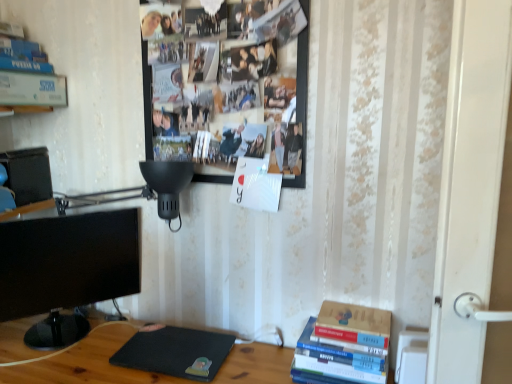
Locate an element on the screen. white matte paperback book at upper left, which is the 2th paperback book from front to back is located at coordinates (32, 89).

What is the approximate width of brown cardboard book at lower right, arranged as the first paperback book when viewed from the front?

brown cardboard book at lower right, arranged as the first paperback book when viewed from the front, is 14.06 centimeters in width.

What are the coordinates of `hardcover books at lower right` in the screenshot? It's located at (344, 345).

The height and width of the screenshot is (384, 512). I want to click on black glossy monitor at left, so click(x=66, y=270).

Locate an element on the screen. white matte paperback book at upper left, which ranks as the second paperback book in bottom-to-top order is located at coordinates 32,89.

Considering the positions of point (49, 335) and point (315, 365), is point (49, 335) closer or farther from the camera than point (315, 365)?

Clearly, point (49, 335) is more distant from the camera than point (315, 365).

Between black glossy monitor at left and hardcover books at lower right, which one has larger size?

black glossy monitor at left is bigger.

Are black glossy monitor at left and hardcover books at lower right far apart?

They are positioned close to each other.

Locate an element on the screen. television above the hardcover books at lower right (from a real-world perspective) is located at coordinates (66, 270).

Which of these two, hardcover books at lower right or brown cardboard book at lower right, acting as the 2th paperback book starting from the back, is thinner?

Thinner between the two is brown cardboard book at lower right, acting as the 2th paperback book starting from the back.

From the image's perspective, does hardcover books at lower right appear lower than brown cardboard book at lower right, which appears as the 1th paperback book when viewed from the right?

Yes.

How far apart are hardcover books at lower right and brown cardboard book at lower right, placed as the first paperback book when sorted from bottom to top?

hardcover books at lower right is 0.96 inches from brown cardboard book at lower right, placed as the first paperback book when sorted from bottom to top.

Which of these two, hardcover books at lower right or brown cardboard book at lower right, placed as the first paperback book when sorted from bottom to top, is bigger?

With larger size is hardcover books at lower right.

Based on the photo, does hardcover books at lower right have a greater height compared to black glossy monitor at left?

In fact, hardcover books at lower right may be shorter than black glossy monitor at left.

Is hardcover books at lower right positioned far away from black glossy monitor at left?

No, hardcover books at lower right is in close proximity to black glossy monitor at left.

Can you confirm if hardcover books at lower right is positioned to the left of black glossy monitor at left?

No, hardcover books at lower right is not to the left of black glossy monitor at left.

Which is closer, (338, 370) or (58, 252)?

Point (338, 370) is closer to the camera than point (58, 252).

Based on the photo, does wooden photo frame at upper center come behind brown cardboard book at lower right, which ranks as the second paperback book in left-to-right order?

No.

Between wooden photo frame at upper center and brown cardboard book at lower right, placed as the first paperback book when sorted from bottom to top, which one has more height?

wooden photo frame at upper center is taller.

From the image's perspective, is wooden photo frame at upper center above brown cardboard book at lower right, acting as the 2th paperback book starting from the back?

Indeed, from the image's perspective, wooden photo frame at upper center is shown above brown cardboard book at lower right, acting as the 2th paperback book starting from the back.

Which of these two, wooden photo frame at upper center or black matte laptop at lower center, stands shorter?

black matte laptop at lower center.

Are wooden photo frame at upper center and black matte laptop at lower center far apart?

They are positioned close to each other.

Is brown cardboard book at lower right, arranged as the first paperback book when viewed from the front, positioned in front of wooden photo frame at upper center?

No, brown cardboard book at lower right, arranged as the first paperback book when viewed from the front, is further to the viewer.

Which is in front, point (338, 316) or point (305, 52)?

Point (305, 52)

Considering the relative positions of brown cardboard book at lower right, the 2th paperback book positioned from the top, and wooden photo frame at upper center in the image provided, is brown cardboard book at lower right, the 2th paperback book positioned from the top, to the right of wooden photo frame at upper center from the viewer's perspective?

Indeed, brown cardboard book at lower right, the 2th paperback book positioned from the top, is positioned on the right side of wooden photo frame at upper center.

Based on the photo, which of these two, brown cardboard book at lower right, the 2th paperback book positioned from the top, or wooden photo frame at upper center, is bigger?

With larger size is wooden photo frame at upper center.

Between hardcover books at lower right and black matte laptop at lower center, which one has more height?

hardcover books at lower right is taller.

In terms of width, does hardcover books at lower right look wider or thinner when compared to black matte laptop at lower center?

In the image, hardcover books at lower right appears to be more narrow than black matte laptop at lower center.

From a real-world perspective, which object stands above the other?

hardcover books at lower right is physically above.

Consider the image. From the image's perspective, would you say hardcover books at lower right is positioned over black matte laptop at lower center?

Yes.

There is a hardcover books at lower right. Where is `television above it (from a real-world perspective)`? television above it (from a real-world perspective) is located at coordinates (66, 270).

Where is `book that is under the brown cardboard book at lower right, which appears as the 1th paperback book when viewed from the right (from a real-world perspective)`? The height and width of the screenshot is (384, 512). book that is under the brown cardboard book at lower right, which appears as the 1th paperback book when viewed from the right (from a real-world perspective) is located at coordinates (344, 345).

Considering their positions, is black matte laptop at lower center positioned further to hardcover books at lower right than brown cardboard book at lower right, acting as the 2th paperback book starting from the back?

black matte laptop at lower center.

Estimate the real-world distances between objects in this image. Which object is closer to hardcover books at lower right, white matte paperback book at upper left, which ranks as the second paperback book in bottom-to-top order, or black glossy monitor at left?

black glossy monitor at left.

Considering their positions, is black matte laptop at lower center positioned further to wooden photo frame at upper center than brown cardboard book at lower right, which ranks as the second paperback book in left-to-right order?

black matte laptop at lower center.

Considering their positions, is brown cardboard book at lower right, the 2th paperback book positioned from the top, positioned closer to white matte paperback book at upper left, the 1th paperback book positioned from the left, than black glossy monitor at left?

The object closer to white matte paperback book at upper left, the 1th paperback book positioned from the left, is black glossy monitor at left.

Which object lies nearer to the anchor point wooden photo frame at upper center, black matte laptop at lower center or white matte paperback book at upper left, the 1th paperback book positioned from the left?

white matte paperback book at upper left, the 1th paperback book positioned from the left, is positioned closer to the anchor wooden photo frame at upper center.

Based on the photo, which object lies further to the anchor point black matte laptop at lower center, white matte paperback book at upper left, which ranks as the 1th paperback book in back-to-front order, or brown cardboard book at lower right, which appears as the 1th paperback book when viewed from the right?

white matte paperback book at upper left, which ranks as the 1th paperback book in back-to-front order.

Based on their spatial positions, is black matte laptop at lower center or black glossy monitor at left closer to white matte paperback book at upper left, the 2th paperback book from the right?

Based on the image, black glossy monitor at left appears to be nearer to white matte paperback book at upper left, the 2th paperback book from the right.

From the picture: Estimate the real-world distances between objects in this image. Which object is closer to white matte paperback book at upper left, which ranks as the 1th paperback book in back-to-front order, black glossy monitor at left or black matte laptop at lower center?

Among the two, black glossy monitor at left is located nearer to white matte paperback book at upper left, which ranks as the 1th paperback book in back-to-front order.

Where is `picture frame situated between white matte paperback book at upper left, the 2th paperback book from the right, and brown cardboard book at lower right, acting as the 2th paperback book starting from the back, from left to right`? The height and width of the screenshot is (384, 512). picture frame situated between white matte paperback book at upper left, the 2th paperback book from the right, and brown cardboard book at lower right, acting as the 2th paperback book starting from the back, from left to right is located at coordinates (301, 93).

Where is `album situated between white matte paperback book at upper left, the 1th paperback book positioned from the left, and brown cardboard book at lower right, arranged as the first paperback book when viewed from the front, from left to right`? album situated between white matte paperback book at upper left, the 1th paperback book positioned from the left, and brown cardboard book at lower right, arranged as the first paperback book when viewed from the front, from left to right is located at coordinates point(176,352).

Where is `book located between black glossy monitor at left and brown cardboard book at lower right, which ranks as the second paperback book in left-to-right order, in the left-right direction`? book located between black glossy monitor at left and brown cardboard book at lower right, which ranks as the second paperback book in left-to-right order, in the left-right direction is located at coordinates (344, 345).

Find the location of `picture frame between white matte paperback book at upper left, which ranks as the 1th paperback book in back-to-front order, and black matte laptop at lower center in the up-down direction`. picture frame between white matte paperback book at upper left, which ranks as the 1th paperback book in back-to-front order, and black matte laptop at lower center in the up-down direction is located at coordinates (x=301, y=93).